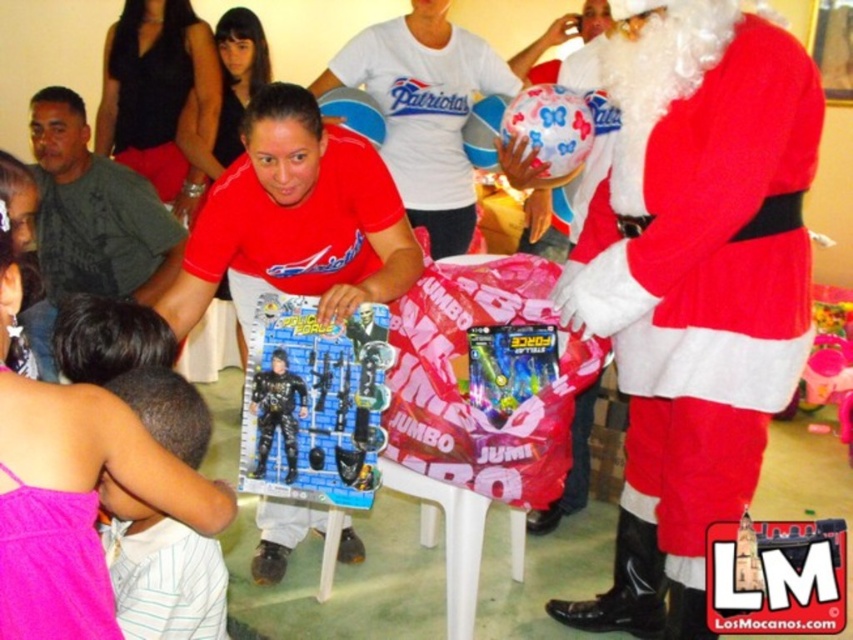
Question: Which point is farther to the camera?

Choices:
 (A) (701, 499)
 (B) (281, 385)
 (C) (28, 388)
 (D) (120, 285)

Answer: (D)

Question: Is pink fabric shirt at lower left below pink striped shirt at lower left?

Choices:
 (A) no
 (B) yes

Answer: (A)

Question: Does pink fabric shirt at lower left have a greater width compared to matte black shirt at center?

Choices:
 (A) no
 (B) yes

Answer: (A)

Question: Which of these objects is positioned closest to the pink striped shirt at lower left?

Choices:
 (A) matte black shirt at center
 (B) dark green fabric shirt at left
 (C) black matte action figure at center
 (D) matte black action figure at center

Answer: (C)

Question: Estimate the real-world distances between objects in this image. Which object is farther from the matte black action figure at center?

Choices:
 (A) red velvet santa claus at right
 (B) dark green fabric shirt at left
 (C) matte white ball at upper center
 (D) white cotton t-shirt at center

Answer: (D)

Question: Observing the image, what is the correct spatial positioning of red velvet santa claus at right in reference to matte white ball at upper center?

Choices:
 (A) right
 (B) left

Answer: (A)